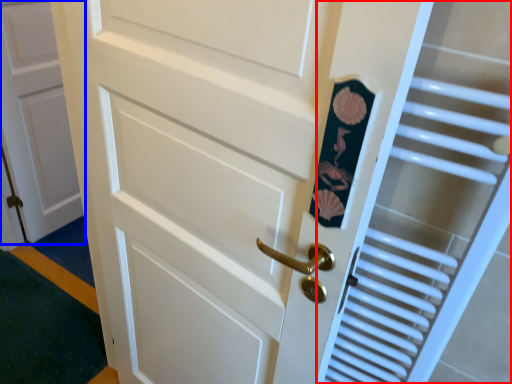
Question: Which point is closer to the camera, elevator (highlighted by a red box) or door (highlighted by a blue box)?

Choices:
 (A) elevator
 (B) door

Answer: (A)